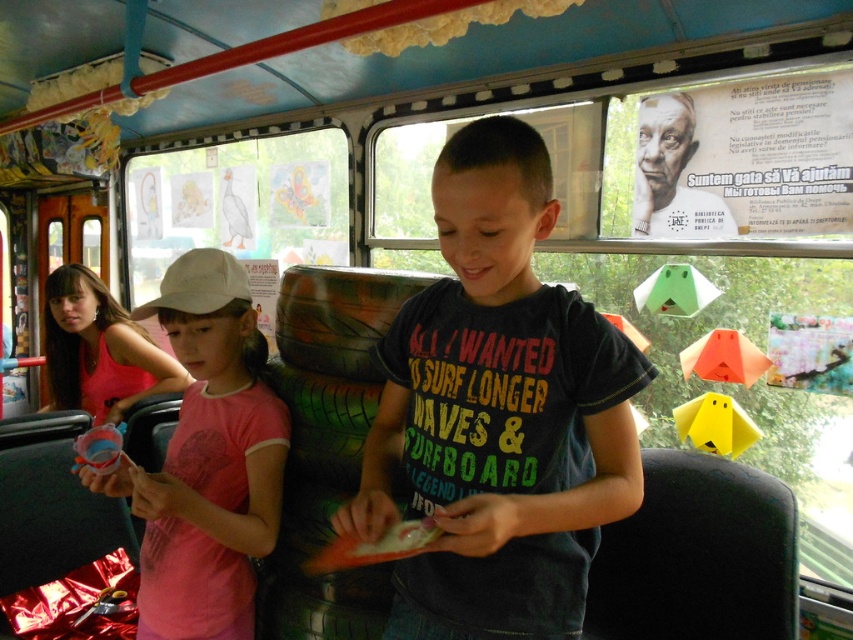
Question: Which point is farther to the camera?

Choices:
 (A) dark blue t-shirt at center
 (B) pink cotton shirt at left

Answer: (B)

Question: Is dark blue t-shirt at center positioned at the back of pink cotton shirt at left?

Choices:
 (A) yes
 (B) no

Answer: (B)

Question: Can you confirm if dark blue t-shirt at center is wider than pink cotton shirt at left?

Choices:
 (A) no
 (B) yes

Answer: (B)

Question: Is dark blue t-shirt at center wider than pink cotton shirt at left?

Choices:
 (A) yes
 (B) no

Answer: (A)